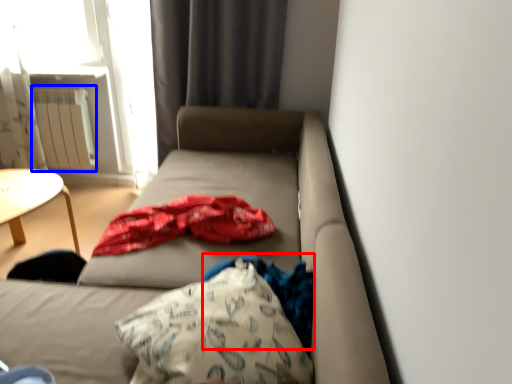
Question: Which point is closer to the camera, clothing (highlighted by a red box) or radiator (highlighted by a blue box)?

Choices:
 (A) clothing
 (B) radiator

Answer: (A)